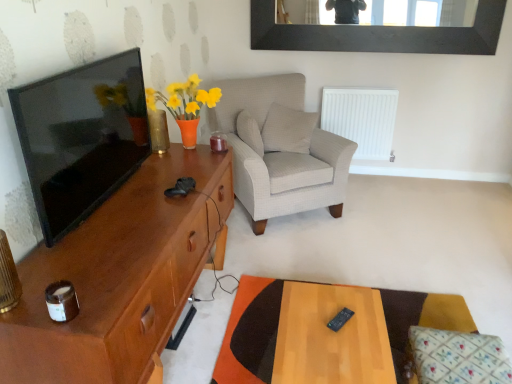
Locate an element on the screen. vacant space that is in between wooden rectangular table at center and light gray fabric armchair at center is located at coordinates (296, 261).